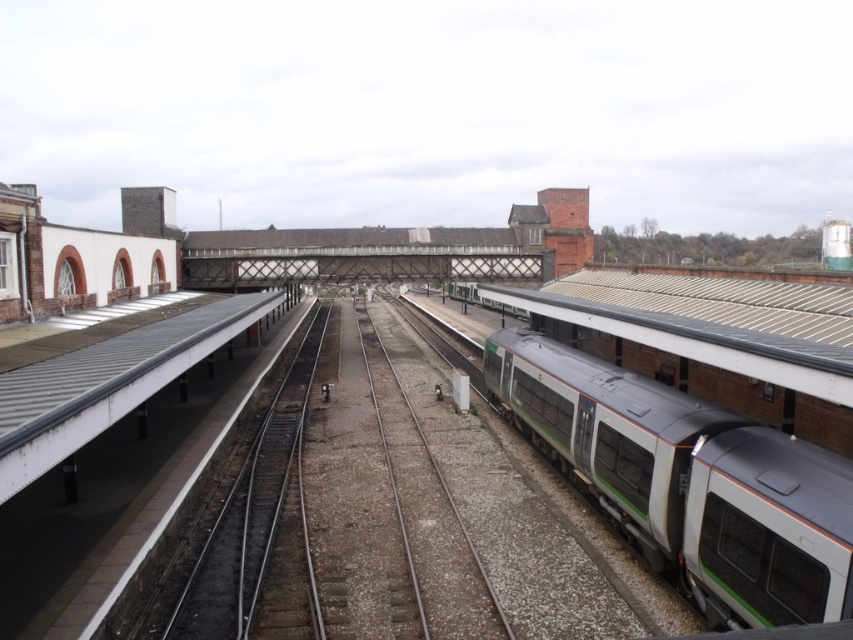
You are standing at the railway station and want to reach the smooth concrete platform at center. Based on the image, in which direction should you walk from your current position to reach it?

The smooth concrete platform at center is located at the coordinates (x=401, y=502) in the image, so you should walk towards the center of the image to reach it.

You are a maintenance worker needing to inspect the green metallic train at right. You are currently standing on the smooth concrete platform at center. Which direction should you move to reach the train?

You should move downward from the smooth concrete platform at center to reach the green metallic train at right since the smooth concrete platform at center is taller than the green metallic train at right.